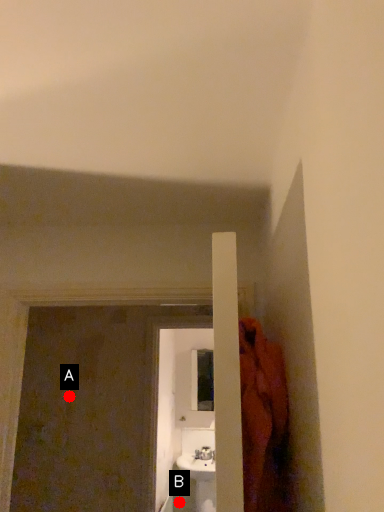
Question: Two points are circled on the image, labeled by A and B beside each circle. Which point is farther to the camera?

Choices:
 (A) A is further
 (B) B is further

Answer: (B)